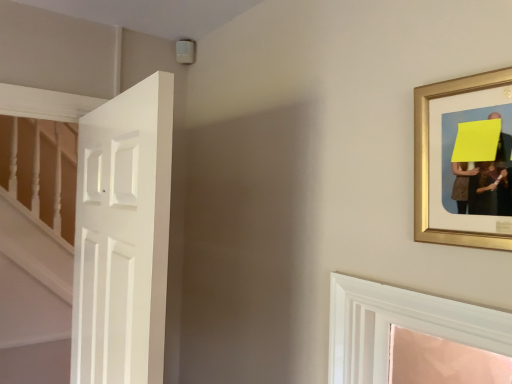
Find the location of `gold framed picture at upper right`. gold framed picture at upper right is located at coordinates (428, 161).

This screenshot has width=512, height=384. What do you see at coordinates (428, 161) in the screenshot?
I see `gold framed picture at upper right` at bounding box center [428, 161].

Find the location of `white matte door at left`. white matte door at left is located at coordinates (123, 236).

Describe the element at coordinates (123, 236) in the screenshot. This screenshot has height=384, width=512. I see `white matte door at left` at that location.

The image size is (512, 384). I want to click on gold framed picture at upper right, so click(428, 161).

Considering the positions of objects gold framed picture at upper right and white matte door at left in the image provided, who is more to the left, gold framed picture at upper right or white matte door at left?

white matte door at left.

In the scene shown: Is gold framed picture at upper right closer to the viewer compared to white matte door at left?

Yes, gold framed picture at upper right is closer to the viewer.

Considering the points (477, 78) and (153, 377), which point is behind, point (477, 78) or point (153, 377)?

Point (153, 377)

Looking at this image, from the image's perspective, which object appears higher, gold framed picture at upper right or white matte door at left?

gold framed picture at upper right.

From a real-world perspective, is gold framed picture at upper right above or below white matte door at left?

In terms of real-world spatial position, gold framed picture at upper right is above white matte door at left.

Is gold framed picture at upper right wider than white matte door at left?

Incorrect, the width of gold framed picture at upper right does not surpass that of white matte door at left.

Between gold framed picture at upper right and white matte door at left, which one has less height?

gold framed picture at upper right is shorter.

Which of these two, gold framed picture at upper right or white matte door at left, is bigger?

white matte door at left.

Can we say gold framed picture at upper right lies outside white matte door at left?

gold framed picture at upper right is positioned outside white matte door at left.

Is gold framed picture at upper right with white matte door at left?

No.

Is gold framed picture at upper right aimed at white matte door at left?

No, gold framed picture at upper right does not turn towards white matte door at left.

How many degrees apart are the facing directions of gold framed picture at upper right and white matte door at left?

gold framed picture at upper right and white matte door at left are facing 2.47 degrees away from each other.

Locate an element on the screen. The image size is (512, 384). door on the left of gold framed picture at upper right is located at coordinates (123, 236).

Considering the positions of objects white matte door at left and gold framed picture at upper right in the image provided, who is more to the right, white matte door at left or gold framed picture at upper right?

Positioned to the right is gold framed picture at upper right.

Does white matte door at left lie behind gold framed picture at upper right?

Yes, white matte door at left is behind gold framed picture at upper right.

Does point (138, 218) appear closer or farther from the camera than point (424, 126)?

Point (138, 218) is farther from the camera than point (424, 126).

From the picture: From the image's perspective, which object appears higher, white matte door at left or gold framed picture at upper right?

gold framed picture at upper right, from the image's perspective.

From a real-world perspective, who is located lower, white matte door at left or gold framed picture at upper right?

white matte door at left is physically lower.

In terms of width, does white matte door at left look wider or thinner when compared to gold framed picture at upper right?

Clearly, white matte door at left has more width compared to gold framed picture at upper right.

Considering the relative sizes of white matte door at left and gold framed picture at upper right in the image provided, is white matte door at left taller than gold framed picture at upper right?

Correct, white matte door at left is much taller as gold framed picture at upper right.

Which of these two, white matte door at left or gold framed picture at upper right, is smaller?

With smaller size is gold framed picture at upper right.

Is gold framed picture at upper right surrounded by white matte door at left?

No, gold framed picture at upper right is not a part of white matte door at left.

Is white matte door at left far from gold framed picture at upper right?

No, white matte door at left is in close proximity to gold framed picture at upper right.

Is white matte door at left facing towards gold framed picture at upper right?

No, white matte door at left is not facing towards gold framed picture at upper right.

How many degrees apart are the facing directions of white matte door at left and gold framed picture at upper right?

2.47 degrees separate the facing orientations of white matte door at left and gold framed picture at upper right.

How distant is white matte door at left from gold framed picture at upper right?

They are 29.25 inches apart.

In order to click on door on the left of gold framed picture at upper right in this screenshot , I will do `click(123, 236)`.

The width and height of the screenshot is (512, 384). Identify the location of door below the gold framed picture at upper right (from a real-world perspective). (123, 236).

This screenshot has height=384, width=512. In order to click on picture frame that is in front of the white matte door at left in this screenshot , I will do `click(428, 161)`.